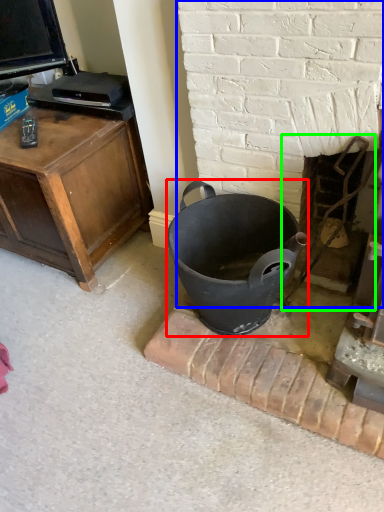
Question: Which is nearer to the trash bin/can (highlighted by a red box)? fireplace (highlighted by a blue box) or fireplace (highlighted by a green box).

Choices:
 (A) fireplace
 (B) fireplace

Answer: (A)